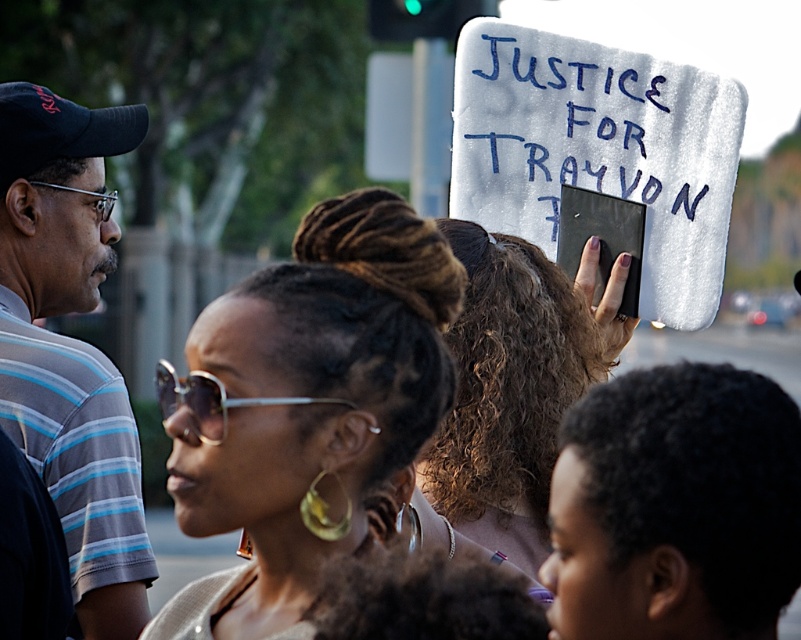
Question: Can you confirm if sunglasses at center is positioned to the right of curly brown hair at center?

Choices:
 (A) no
 (B) yes

Answer: (A)

Question: Among these points, which one is farthest from the camera?

Choices:
 (A) (220, 428)
 (B) (58, 221)
 (C) (520, 384)
 (D) (385, 369)

Answer: (B)

Question: Which point appears farthest from the camera in this image?

Choices:
 (A) coord(194,376)
 (B) coord(70,344)

Answer: (B)

Question: Is sunglasses at center further to camera compared to curly brown hair at center?

Choices:
 (A) no
 (B) yes

Answer: (A)

Question: Is striped cotton shirt at left below curly brown hair at center?

Choices:
 (A) yes
 (B) no

Answer: (A)

Question: Considering the real-world distances, which object is closest to the curly brown hair at center?

Choices:
 (A) silver metallic sunglasses at center
 (B) striped cotton shirt at left
 (C) sunglasses at center

Answer: (C)